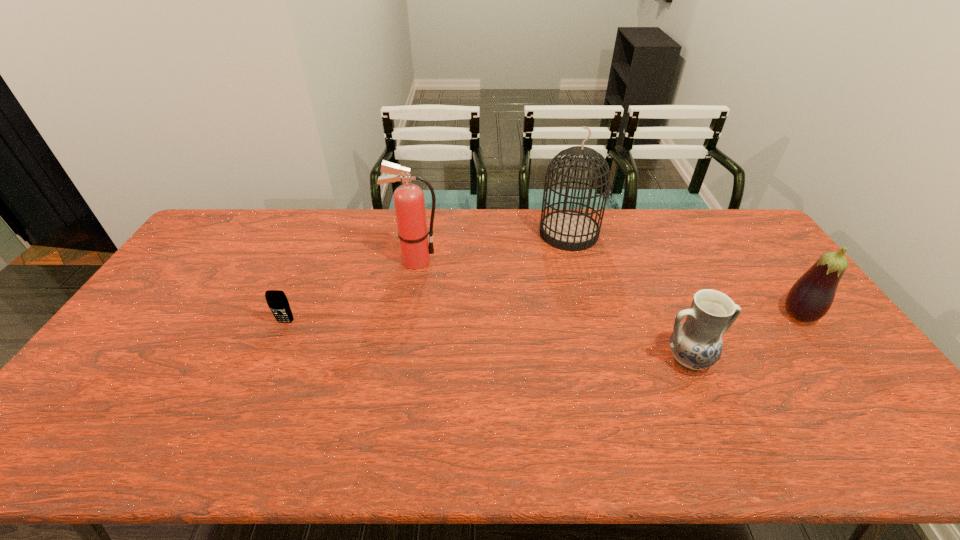
At what (x,y) coordinates should I click in order to perform the action: click on vacant space that's between the third shortest object and the fire extinguisher. Please return your answer as a coordinate pair (x, y). This screenshot has width=960, height=540. Looking at the image, I should click on (607, 288).

In order to click on object that ranks as the fourth closest to the fourth object from left to right in this screenshot , I will do `click(277, 301)`.

The width and height of the screenshot is (960, 540). Find the location of `object that is the second closest to the third shortest object`. object that is the second closest to the third shortest object is located at coordinates (569, 230).

Where is `vacant area in the image that satisfies the following two spatial constraints: 1. on the hose direction of the fourth object from right to left; 2. on the screen of the cellular telephone`? vacant area in the image that satisfies the following two spatial constraints: 1. on the hose direction of the fourth object from right to left; 2. on the screen of the cellular telephone is located at coordinates (405, 322).

You are a GUI agent. You are given a task and a screenshot of the screen. Output one action in this format:
    pyautogui.click(x=<x>, y=<y>)
    Task: Click on the free spot that satisfies the following two spatial constraints: 1. on the hose direction of the second object from left to right; 2. on the right side of the rightmost object
    The width and height of the screenshot is (960, 540).
    Given the screenshot: What is the action you would take?
    pyautogui.click(x=406, y=315)

The image size is (960, 540). In order to click on free location that satisfies the following two spatial constraints: 1. on the hose direction of the second farthest object; 2. on the screen of the leftmost object in this screenshot , I will do `click(405, 322)`.

The width and height of the screenshot is (960, 540). What are the coordinates of `free space in the image that satisfies the following two spatial constraints: 1. on the hose direction of the fourth nearest object; 2. on the right side of the rightmost object` in the screenshot? It's located at (406, 315).

At what (x,y) coordinates should I click in order to perform the action: click on vacant region that satisfies the following two spatial constraints: 1. on the hose direction of the fourth nearest object; 2. on the back side of the third shortest object. Please return your answer as a coordinate pair (x, y). This screenshot has height=540, width=960. Looking at the image, I should click on (406, 315).

At what (x,y) coordinates should I click in order to perform the action: click on vacant space that satisfies the following two spatial constraints: 1. on the hose direction of the eggplant; 2. on the left side of the fourth object from right to left. Please return your answer as a coordinate pair (x, y). The width and height of the screenshot is (960, 540). Looking at the image, I should click on (406, 315).

Locate an element on the screen. free space that satisfies the following two spatial constraints: 1. on the hose direction of the fourth object from left to right; 2. on the left side of the fire extinguisher is located at coordinates (398, 360).